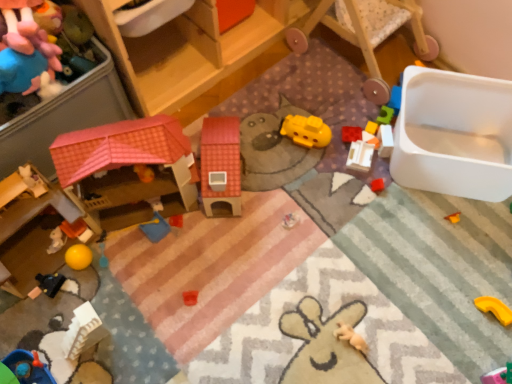
At what (x,y) coordinates should I click in order to perform the action: click on vacant space in front of matte plastic dollhouse at center-left, acting as the eighth toy starting from the right. Please return your answer as a coordinate pair (x, y). Looking at the image, I should click on (173, 294).